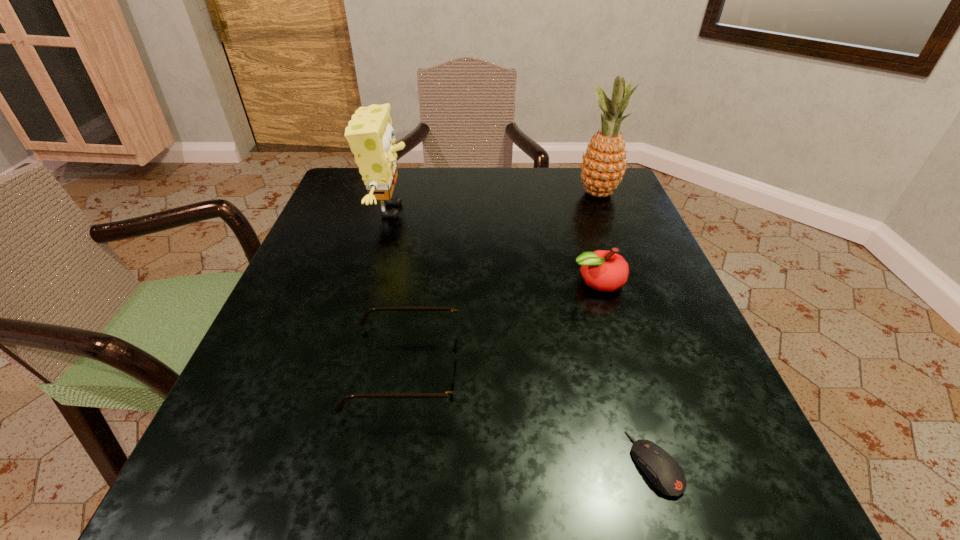
Image resolution: width=960 pixels, height=540 pixels. Identify the location of pineapple. click(x=604, y=164).

Find the location of `sponge`. sponge is located at coordinates (370, 135).

What are the coordinates of `the third tallest object` in the screenshot? It's located at (602, 270).

Identify the location of apple. Image resolution: width=960 pixels, height=540 pixels. tap(602, 270).

Locate an element on the screen. This screenshot has width=960, height=540. the second nearest object is located at coordinates (455, 350).

Find the location of `the second shortest object`. the second shortest object is located at coordinates (455, 350).

You are a GUI agent. You are given a task and a screenshot of the screen. Output one action in this format:
    pyautogui.click(x=<x>, y=<y>)
    Task: Click on the computer mouse
    
    Given the screenshot: What is the action you would take?
    pyautogui.click(x=662, y=470)

Where is `the shortest object`? the shortest object is located at coordinates (662, 470).

Find the location of a particular element. This screenshot has width=960, height=540. blank area located on the front of the pineapple is located at coordinates (612, 227).

The image size is (960, 540). What are the coordinates of `blank area located on the face of the second tallest object` in the screenshot? It's located at (533, 211).